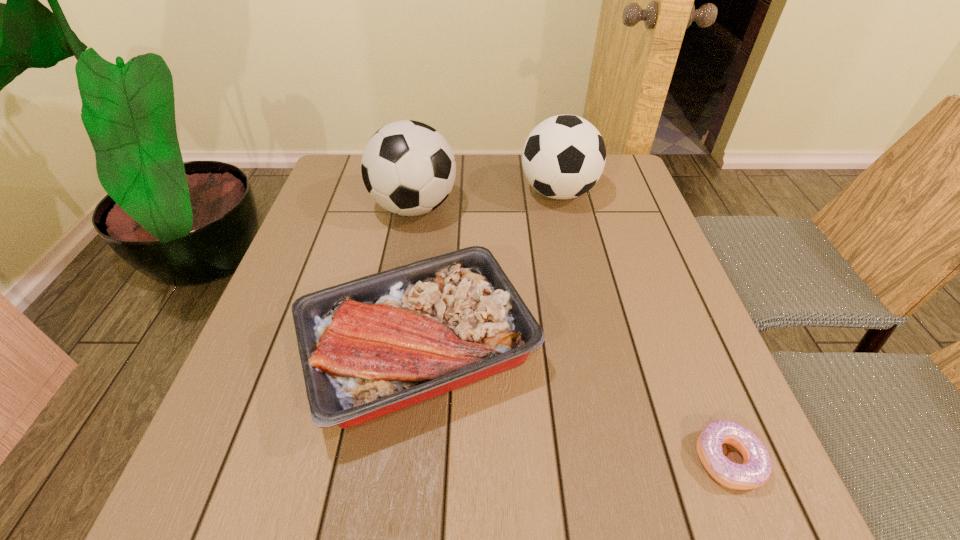
Locate an element on the screen. The width and height of the screenshot is (960, 540). the left soccer ball is located at coordinates coord(408,168).

Locate an element on the screen. The image size is (960, 540). the right soccer ball is located at coordinates pyautogui.click(x=564, y=156).

Identify the location of the third tallest object. Image resolution: width=960 pixels, height=540 pixels. (369, 347).

At what (x,y) coordinates should I click in order to perform the action: click on the rightmost object. Please return your answer as a coordinate pair (x, y). The height and width of the screenshot is (540, 960). Looking at the image, I should click on (756, 470).

I want to click on doughnut, so click(x=756, y=470).

I want to click on blank area located 0.080m on the left of the left soccer ball, so click(x=341, y=207).

At what (x,y) coordinates should I click in order to perform the action: click on free space located on the front of the right soccer ball. Please return your answer as a coordinate pair (x, y). The image size is (960, 540). Looking at the image, I should click on (584, 308).

Locate an element on the screen. vacant space located 0.190m on the right of the tray is located at coordinates (636, 351).

You are a GUI agent. You are given a task and a screenshot of the screen. Output one action in this format:
    pyautogui.click(x=<x>, y=<y>)
    Task: Click on the free spot located on the back of the doughnut
    The image size is (960, 540).
    Given the screenshot: What is the action you would take?
    pyautogui.click(x=655, y=275)

I want to click on object at the near edge, so click(756, 470).